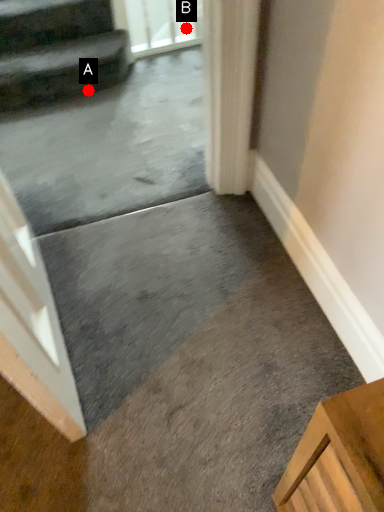
Question: Two points are circled on the image, labeled by A and B beside each circle. Which point is closer to the camera?

Choices:
 (A) A is closer
 (B) B is closer

Answer: (A)